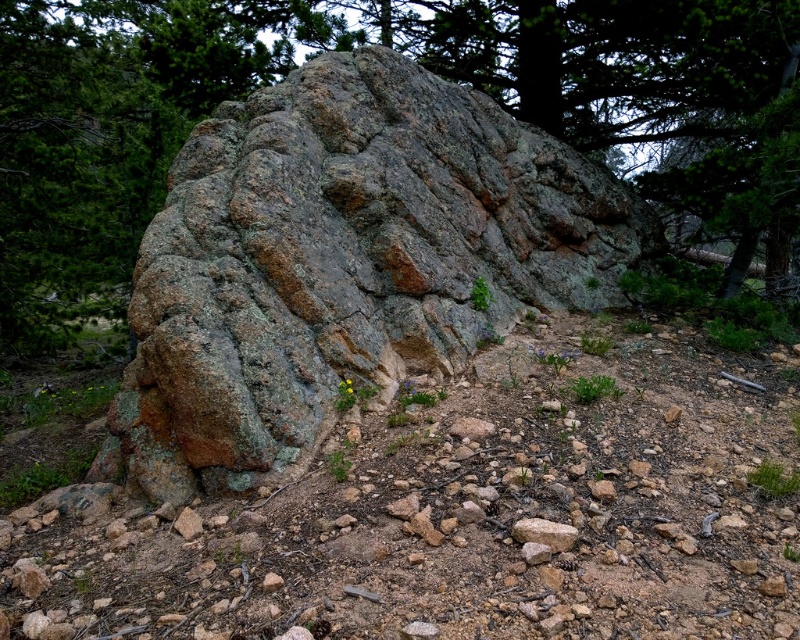
Question: Which of the following is the farthest from the observer?

Choices:
 (A) gray rough stone at center
 (B) rusty granite boulder at center

Answer: (B)

Question: Can you confirm if rusty granite boulder at center is smaller than gray rough stone at center?

Choices:
 (A) yes
 (B) no

Answer: (B)

Question: Which of the following is the farthest from the observer?

Choices:
 (A) gray rough stone at center
 (B) rusty granite boulder at center

Answer: (B)

Question: Is the position of rusty granite boulder at center less distant than that of gray rough stone at center?

Choices:
 (A) yes
 (B) no

Answer: (B)

Question: Can you confirm if rusty granite boulder at center is positioned below gray rough stone at center?

Choices:
 (A) yes
 (B) no

Answer: (B)